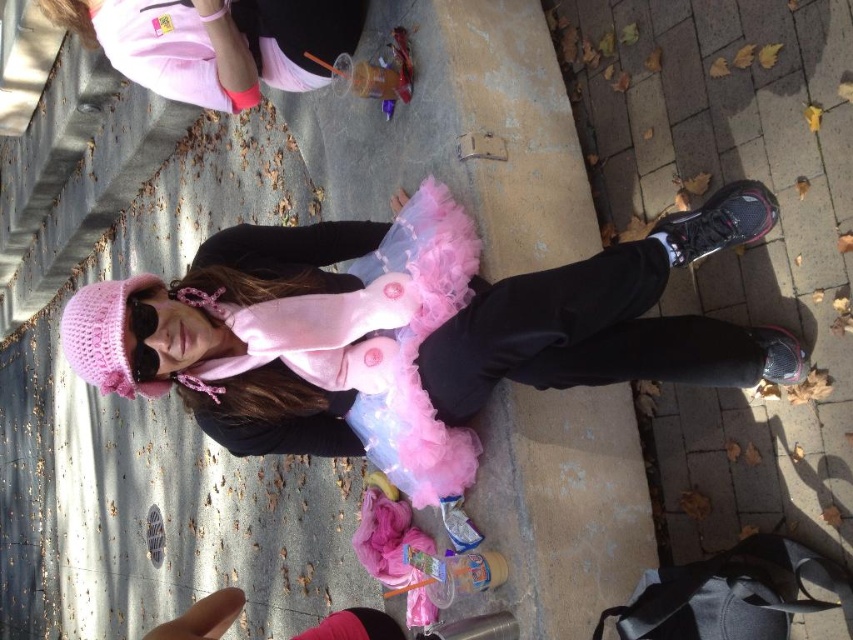
Question: Based on their relative distances, which object is nearer to the fuzzy pink dress at center?

Choices:
 (A) pink fabric dress at upper left
 (B) fuzzy pink tutu at center

Answer: (B)

Question: Is fuzzy pink dress at center bigger than pink fabric dress at upper left?

Choices:
 (A) no
 (B) yes

Answer: (B)

Question: Is fuzzy pink tutu at center wider than pink fabric dress at upper left?

Choices:
 (A) yes
 (B) no

Answer: (A)

Question: Which point is closer to the camera?

Choices:
 (A) fuzzy pink dress at center
 (B) pink fabric dress at upper left
 (C) fuzzy pink tutu at center

Answer: (C)

Question: Does fuzzy pink dress at center lie behind pink fabric dress at upper left?

Choices:
 (A) no
 (B) yes

Answer: (A)

Question: Which is nearer to the fuzzy pink dress at center?

Choices:
 (A) fuzzy pink tutu at center
 (B) pink fabric dress at upper left

Answer: (A)